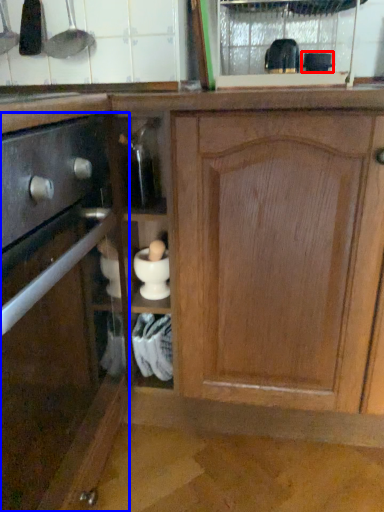
Question: Which object is further to the camera taking this photo, appliance (highlighted by a red box) or cabinetry (highlighted by a blue box)?

Choices:
 (A) appliance
 (B) cabinetry

Answer: (A)